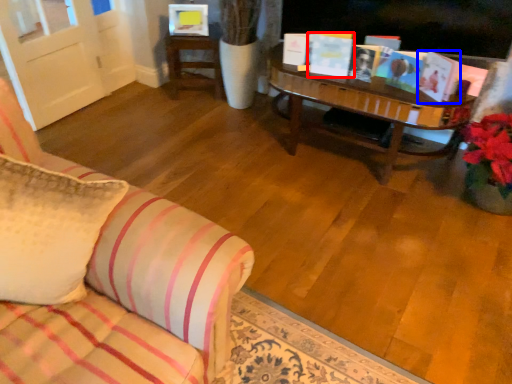
Question: Which of the following is the farthest to the observer, book (highlighted by a red box) or book (highlighted by a blue box)?

Choices:
 (A) book
 (B) book

Answer: (A)